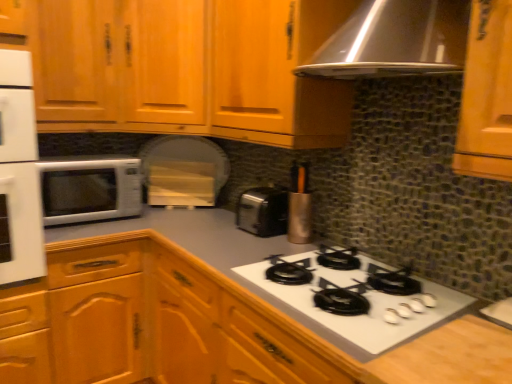
This screenshot has height=384, width=512. I want to click on free space that is in between white glossy gas stove at center and satin silver toaster at center, so coord(257,244).